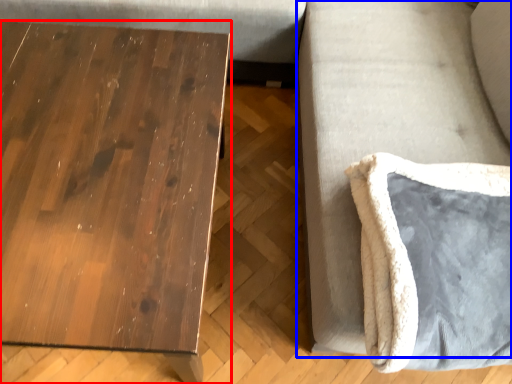
Question: Which object is closer to the camera taking this photo, table (highlighted by a red box) or couch (highlighted by a blue box)?

Choices:
 (A) table
 (B) couch

Answer: (B)